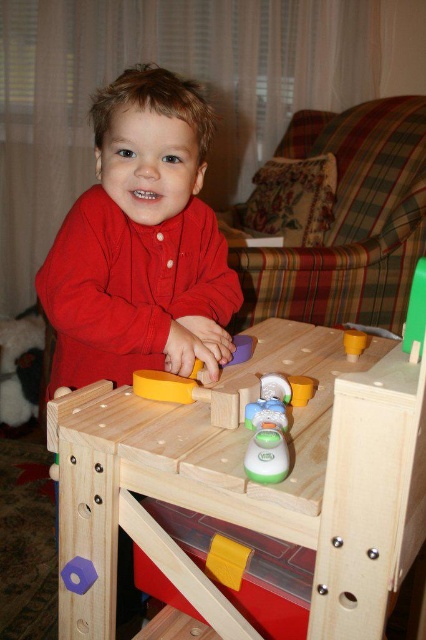
Question: Does natural wood workbench at center have a lesser width compared to matte red shirt at center?

Choices:
 (A) no
 (B) yes

Answer: (A)

Question: Which of the following is the farthest from the observer?

Choices:
 (A) (348, 332)
 (B) (333, 492)

Answer: (A)

Question: Can you confirm if matte red shirt at center is bigger than yellow matte hammer at center?

Choices:
 (A) no
 (B) yes

Answer: (B)

Question: Which of the following is the closest to the observer?

Choices:
 (A) (112, 264)
 (B) (359, 339)
 (C) (253, 486)

Answer: (C)

Question: Is natural wood workbench at center above matte red shirt at center?

Choices:
 (A) yes
 (B) no

Answer: (B)

Question: Which point is farther to the camera?

Choices:
 (A) natural wood workbench at center
 (B) matte red shirt at center
 (C) yellow matte hammer at center

Answer: (C)